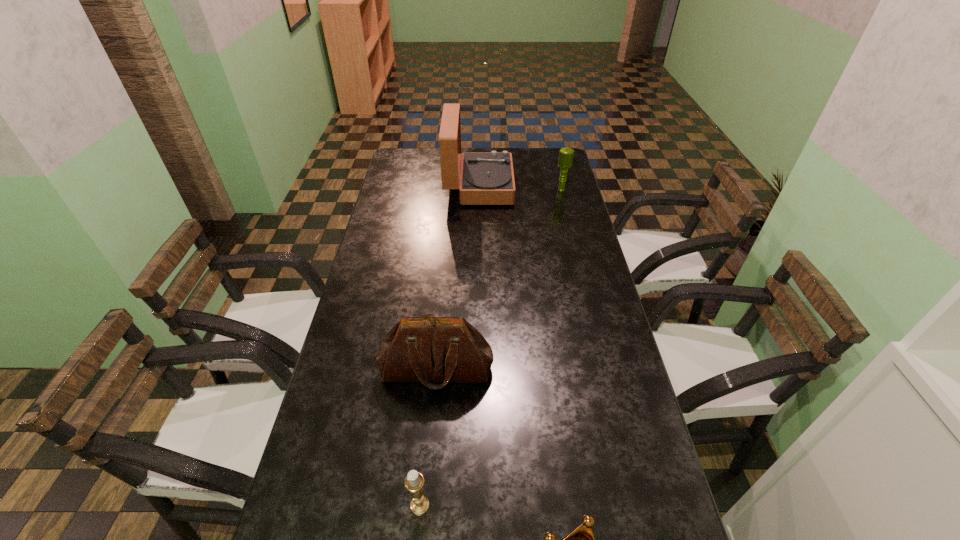
Where is `vacant area between the shoulder bag and the rightmost object`? The width and height of the screenshot is (960, 540). vacant area between the shoulder bag and the rightmost object is located at coordinates (499, 280).

Locate an element on the screen. free space between the microphone and the shoulder bag is located at coordinates (499, 280).

Identify which object is the third nearest to the fourth shortest object. Please provide its 2D coordinates. Your answer should be formatted as a tuple, i.e. [(x, y)], where the tuple contains the x and y coordinates of a point satisfying the conditions above.

[(487, 178)]

Locate an element on the screen. The height and width of the screenshot is (540, 960). the third closest object to the crown is located at coordinates (487, 178).

Locate an element on the screen. Image resolution: width=960 pixels, height=540 pixels. free spot that satisfies the following two spatial constraints: 1. on the face of the microphone; 2. on the left side of the tallest object is located at coordinates tap(479, 190).